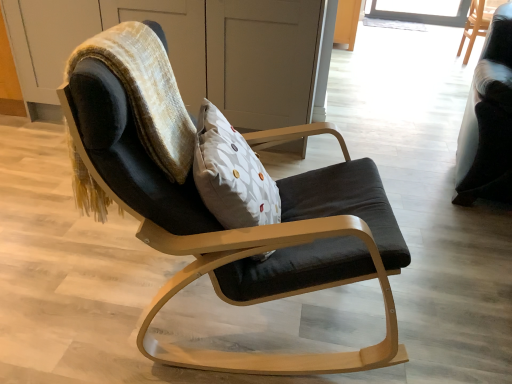
What is the approximate height of matte wood dresser at center?

35.66 inches.

This screenshot has height=384, width=512. Describe the element at coordinates (200, 50) in the screenshot. I see `matte wood dresser at center` at that location.

Measure the distance between point (486,15) and camera.

The depth of point (486,15) is 16.95 feet.

What is the approximate width of velvet black bean bag chair at upper left?

15.81 inches.

Measure the distance between point (462, 155) and camera.

Point (462, 155) and camera are 7.38 feet apart from each other.

I want to click on matte wood dresser at center, so click(x=200, y=50).

Is matte wood dresser at center touching velvet black armchair at right, marked as the second chair in a left-to-right arrangement?

No, matte wood dresser at center is not next to velvet black armchair at right, marked as the second chair in a left-to-right arrangement.

From a real-world perspective, which chair is the 2nd one above the matte wood dresser at center? Please provide its 2D coordinates.

[(488, 120)]

Is matte wood dresser at center positioned beyond the bounds of velvet black armchair at right, which is counted as the second chair, starting from the front?

Yes.

How different are the orientations of matte wood dresser at center and velvet black armchair at right, the second chair in the back-to-front sequence, in degrees?

There is a 12.2-degree angle between the facing directions of matte wood dresser at center and velvet black armchair at right, the second chair in the back-to-front sequence.

In the scene shown: Is velvet black chair at center, which is the 3th chair in right-to-left order, thinner than white dotted pillow at center?

In fact, velvet black chair at center, which is the 3th chair in right-to-left order, might be wider than white dotted pillow at center.

Is velvet black chair at center, marked as the third chair in a back-to-front arrangement, situated inside white dotted pillow at center or outside?

velvet black chair at center, marked as the third chair in a back-to-front arrangement, is not enclosed by white dotted pillow at center.

Considering the sizes of objects velvet black chair at center, marked as the third chair in a back-to-front arrangement, and white dotted pillow at center in the image provided, who is smaller, velvet black chair at center, marked as the third chair in a back-to-front arrangement, or white dotted pillow at center?

white dotted pillow at center is smaller.

Who is taller, velvet black chair at center, the first chair from the front, or white dotted pillow at center?

velvet black chair at center, the first chair from the front.

Looking at this image, does black fabric chair at upper right, positioned as the third chair in left-to-right order, contain velvet black chair at center, marked as the third chair in a back-to-front arrangement?

No, velvet black chair at center, marked as the third chair in a back-to-front arrangement, is not surrounded by black fabric chair at upper right, positioned as the third chair in left-to-right order.

Is black fabric chair at upper right, which appears as the 1th chair when viewed from the back, not near velvet black chair at center, which is the 3th chair in right-to-left order?

black fabric chair at upper right, which appears as the 1th chair when viewed from the back, is far away from velvet black chair at center, which is the 3th chair in right-to-left order.

Based on the photo, does black fabric chair at upper right, the first chair in the right-to-left sequence, appear on the right side of velvet black chair at center, marked as the first chair in a left-to-right arrangement?

Indeed, black fabric chair at upper right, the first chair in the right-to-left sequence, is positioned on the right side of velvet black chair at center, marked as the first chair in a left-to-right arrangement.

Between velvet black armchair at right, which is counted as the second chair, starting from the front, and white dotted pillow at center, which one has less height?

white dotted pillow at center is shorter.

Can you see velvet black armchair at right, marked as the second chair in a left-to-right arrangement, touching white dotted pillow at center?

No, velvet black armchair at right, marked as the second chair in a left-to-right arrangement, is not in contact with white dotted pillow at center.

Is velvet black armchair at right, marked as the second chair in a left-to-right arrangement, further to the viewer compared to white dotted pillow at center?

Yes.

Can we say velvet black armchair at right, the second chair in the back-to-front sequence, lies outside white dotted pillow at center?

velvet black armchair at right, the second chair in the back-to-front sequence, lies outside white dotted pillow at center's area.

Considering the sizes of objects black fabric chair at upper right, the first chair in the right-to-left sequence, and white dotted pillow at center in the image provided, who is bigger, black fabric chair at upper right, the first chair in the right-to-left sequence, or white dotted pillow at center?

black fabric chair at upper right, the first chair in the right-to-left sequence, is bigger.

In the scene shown: Is black fabric chair at upper right, positioned as the third chair in left-to-right order, positioned with its back to white dotted pillow at center?

No.

Considering the sizes of black fabric chair at upper right, positioned as the third chair in left-to-right order, and white dotted pillow at center in the image, is black fabric chair at upper right, positioned as the third chair in left-to-right order, taller or shorter than white dotted pillow at center?

Considering their sizes, black fabric chair at upper right, positioned as the third chair in left-to-right order, has more height than white dotted pillow at center.

Between velvet black armchair at right, the second chair in the back-to-front sequence, and velvet black bean bag chair at upper left, which one has smaller width?

Thinner between the two is velvet black bean bag chair at upper left.

Is point (509, 44) positioned behind point (112, 47)?

Yes.

In the image, is velvet black armchair at right, the second chair in the back-to-front sequence, positioned in front of or behind velvet black bean bag chair at upper left?

velvet black armchair at right, the second chair in the back-to-front sequence, is behind velvet black bean bag chair at upper left.

Is matte wood dresser at center taller or shorter than velvet black bean bag chair at upper left?

Considering their sizes, matte wood dresser at center has more height than velvet black bean bag chair at upper left.

From the picture: Is matte wood dresser at center not close to velvet black bean bag chair at upper left?

That's right, there is a large distance between matte wood dresser at center and velvet black bean bag chair at upper left.

From the picture: Is the depth of matte wood dresser at center greater than that of velvet black bean bag chair at upper left?

Yes, it is behind velvet black bean bag chair at upper left.

From the image's perspective, which is below, matte wood dresser at center or velvet black bean bag chair at upper left?

velvet black bean bag chair at upper left.

Find the location of `chair that is the 2nd object above the matte wood dresser at center (from a real-world perspective)`. chair that is the 2nd object above the matte wood dresser at center (from a real-world perspective) is located at coordinates (488, 120).

Locate an element on the screen. The height and width of the screenshot is (384, 512). the 1st chair counting from the right of the white dotted pillow at center is located at coordinates (244, 230).

From the image, which object appears to be farther from velvet black bean bag chair at upper left, white dotted pillow at center or matte wood dresser at center?

matte wood dresser at center lies further to velvet black bean bag chair at upper left than the other object.

Based on their spatial positions, is velvet black armchair at right, the second chair in the back-to-front sequence, or matte wood dresser at center further from black fabric chair at upper right, which appears as the 1th chair when viewed from the back?

matte wood dresser at center is further to black fabric chair at upper right, which appears as the 1th chair when viewed from the back.

Estimate the real-world distances between objects in this image. Which object is further from velvet black armchair at right, marked as the second chair in a left-to-right arrangement, velvet black chair at center, marked as the third chair in a back-to-front arrangement, or velvet black bean bag chair at upper left?

Among the two, velvet black bean bag chair at upper left is located further to velvet black armchair at right, marked as the second chair in a left-to-right arrangement.

When comparing their distances from velvet black armchair at right, the second chair in the back-to-front sequence, does velvet black chair at center, marked as the third chair in a back-to-front arrangement, or white dotted pillow at center seem closer?

velvet black chair at center, marked as the third chair in a back-to-front arrangement, is closer to velvet black armchair at right, the second chair in the back-to-front sequence.

Looking at this image, looking at the image, which one is located further to matte wood dresser at center, black fabric chair at upper right, which appears as the 1th chair when viewed from the back, or velvet black chair at center, the first chair from the front?

black fabric chair at upper right, which appears as the 1th chair when viewed from the back, lies further to matte wood dresser at center than the other object.

Which object lies nearer to the anchor point velvet black chair at center, the first chair from the front, white dotted pillow at center or velvet black armchair at right, marked as the second chair in a left-to-right arrangement?

white dotted pillow at center lies closer to velvet black chair at center, the first chair from the front, than the other object.

When comparing their distances from velvet black bean bag chair at upper left, does matte wood dresser at center or velvet black chair at center, marked as the third chair in a back-to-front arrangement, seem further?

matte wood dresser at center.

Looking at the image, which one is located closer to velvet black armchair at right, which is counted as the second chair, starting from the front, black fabric chair at upper right, positioned as the 3th chair in front-to-back order, or matte wood dresser at center?

The object closer to velvet black armchair at right, which is counted as the second chair, starting from the front, is matte wood dresser at center.

Where is `pillow between velvet black chair at center, the first chair from the front, and matte wood dresser at center in the front-back direction`? The width and height of the screenshot is (512, 384). pillow between velvet black chair at center, the first chair from the front, and matte wood dresser at center in the front-back direction is located at coordinates (231, 174).

The height and width of the screenshot is (384, 512). Find the location of `pillow located between velvet black bean bag chair at upper left and velvet black armchair at right, placed as the 2th chair when sorted from right to left, in the left-right direction`. pillow located between velvet black bean bag chair at upper left and velvet black armchair at right, placed as the 2th chair when sorted from right to left, in the left-right direction is located at coordinates (231, 174).

This screenshot has height=384, width=512. I want to click on bean bag chair between white dotted pillow at center and matte wood dresser at center along the z-axis, so pos(146,91).

Where is `bean bag chair between matte wood dresser at center and velvet black armchair at right, marked as the second chair in a left-to-right arrangement, in the horizontal direction`? Image resolution: width=512 pixels, height=384 pixels. bean bag chair between matte wood dresser at center and velvet black armchair at right, marked as the second chair in a left-to-right arrangement, in the horizontal direction is located at coordinates (146, 91).